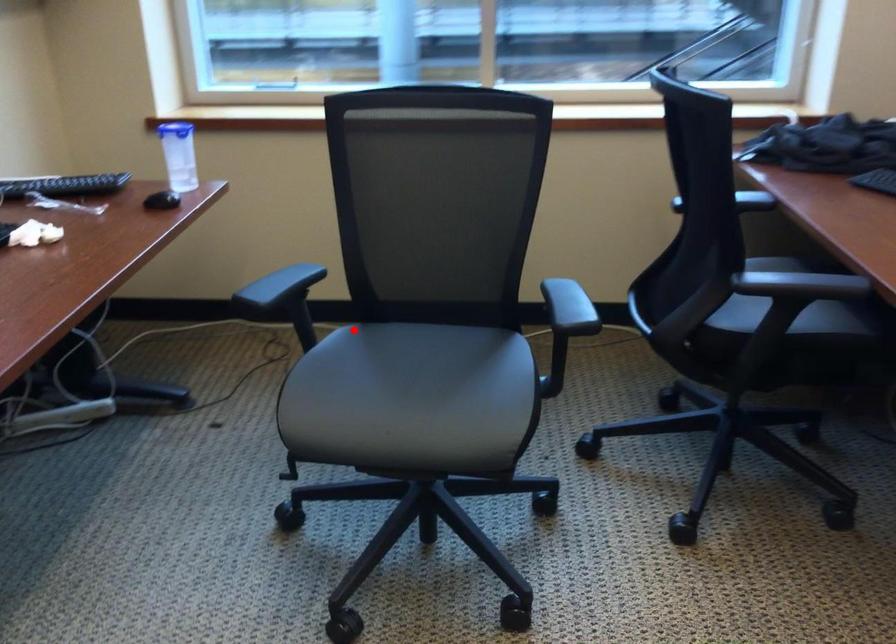
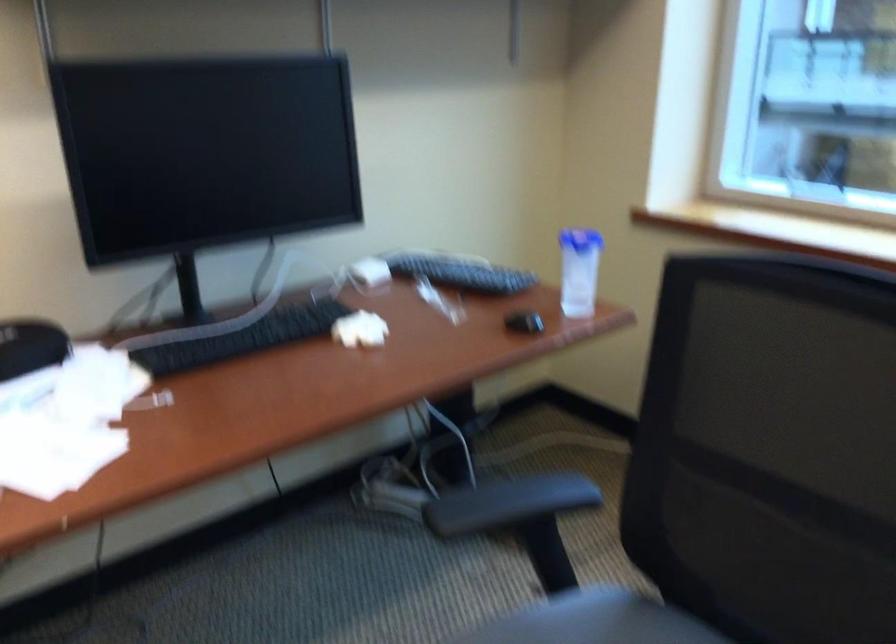
Question: I am providing you with two images of the same scene from different viewpoints. In image1, a red point is highlighted. Considering the same 3D point in image2, which of the following is correct?

Choices:
 (A) It is closer
 (B) It is farther

Answer: (A)